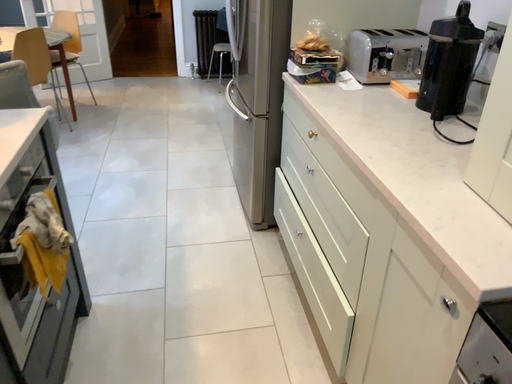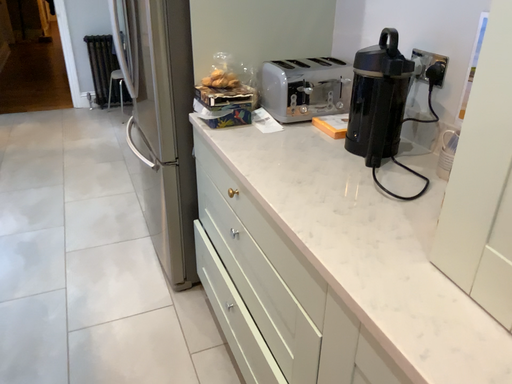
Question: Which way did the camera rotate in the video?

Choices:
 (A) rotated left
 (B) rotated right

Answer: (B)